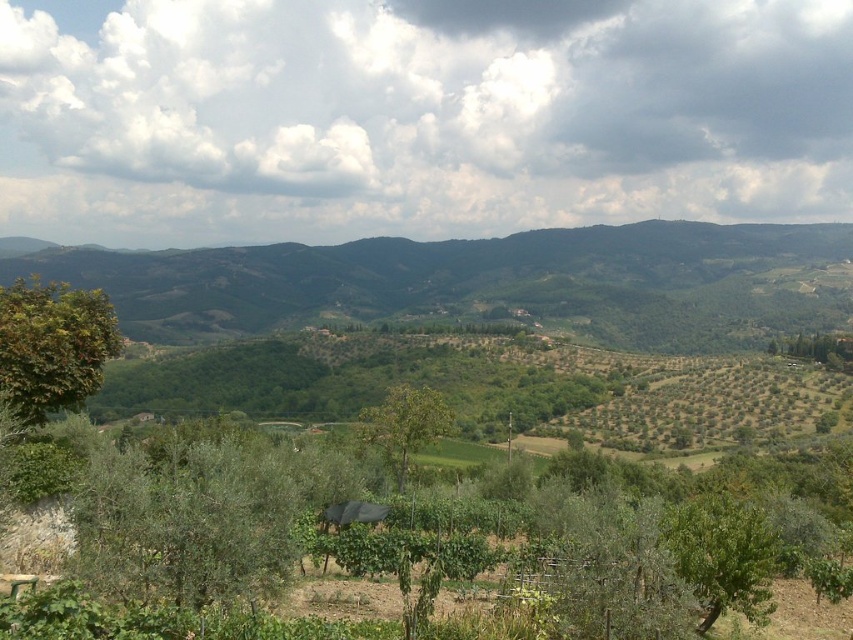
You are a hiker standing at the base of the green leafy hillside at center and want to reach the green leafy tree at lower right. Which direction should you walk to get there?

The green leafy tree at lower right is behind the green leafy hillside at center, so you should walk towards the direction away from the hillside to reach the tree.

Looking at this image, you are a drone operator tasked with capturing aerial footage of the green leafy hillside at center. Based on the coordinates provided, can you determine if the hillside is positioned centrally within the frame?

The green leafy hillside at center is located at point coordinates approximately 0.442 on the x and 0.569 on the y axis, which is near the center of the frame, so yes, it is positioned centrally within the frame.